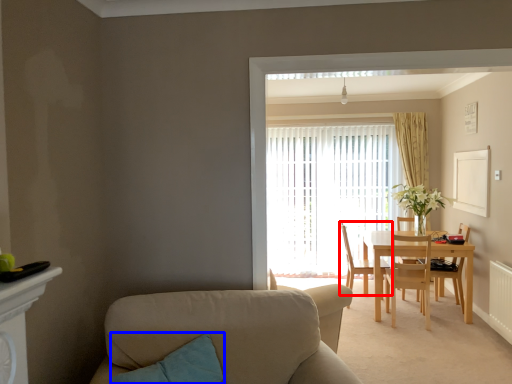
Question: Among these objects, which one is nearest to the camera, chair (highlighted by a red box) or pillow (highlighted by a blue box)?

Choices:
 (A) chair
 (B) pillow

Answer: (B)